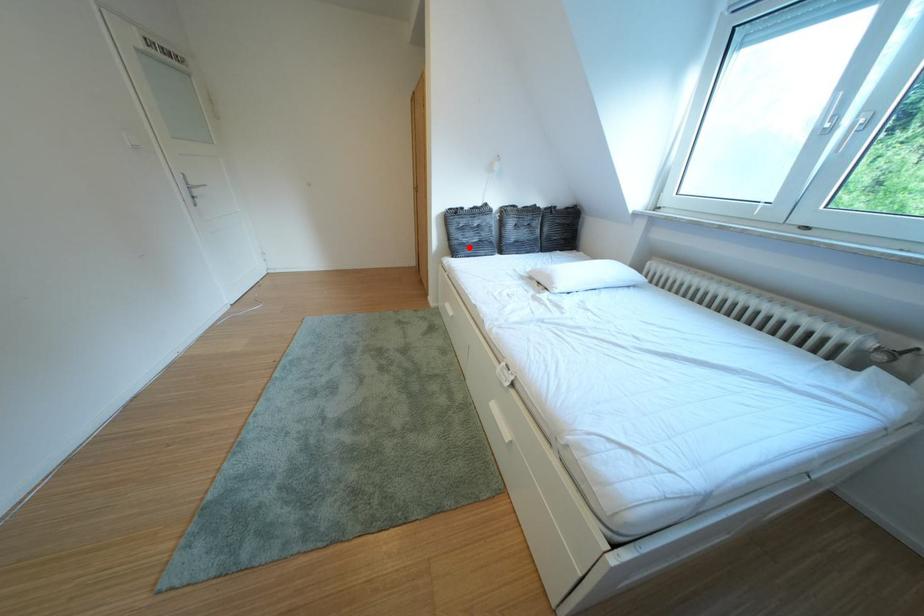
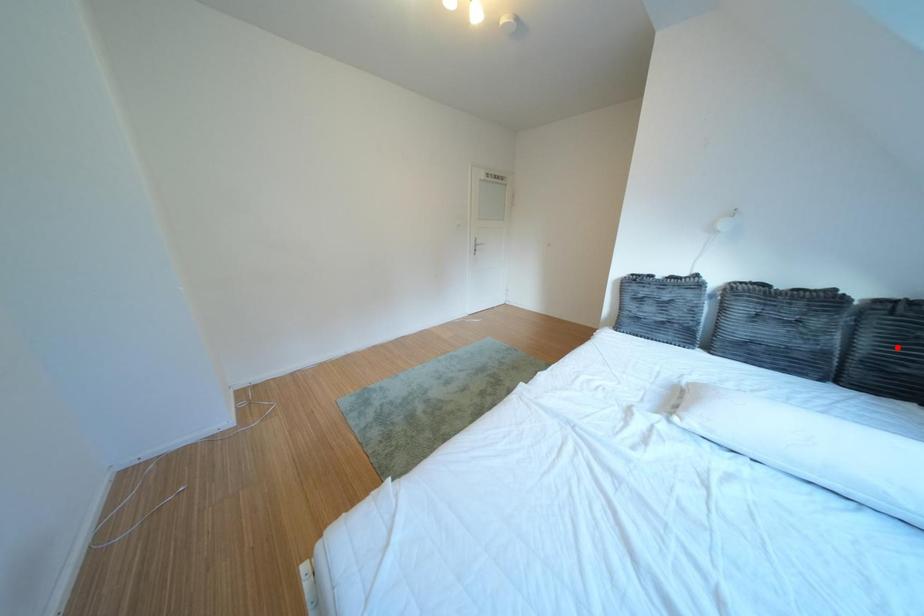
Based on the photo, I am providing you with two images of the same scene from different viewpoints. A red point is marked on the first image and another point is marked on the second image. Is the marked point in image1 the same physical position as the marked point in image2?

Answer: No